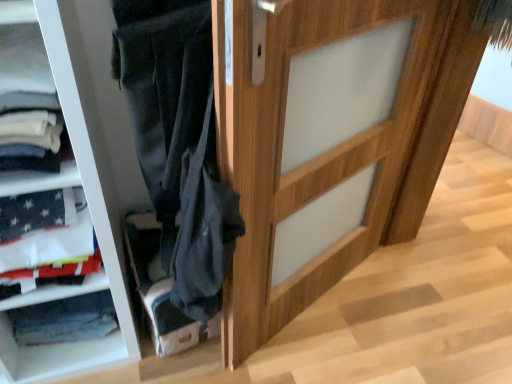
This screenshot has height=384, width=512. What are the coordinates of `vacant space in front of velvet dark blue pants at lower center` in the screenshot? It's located at (184, 373).